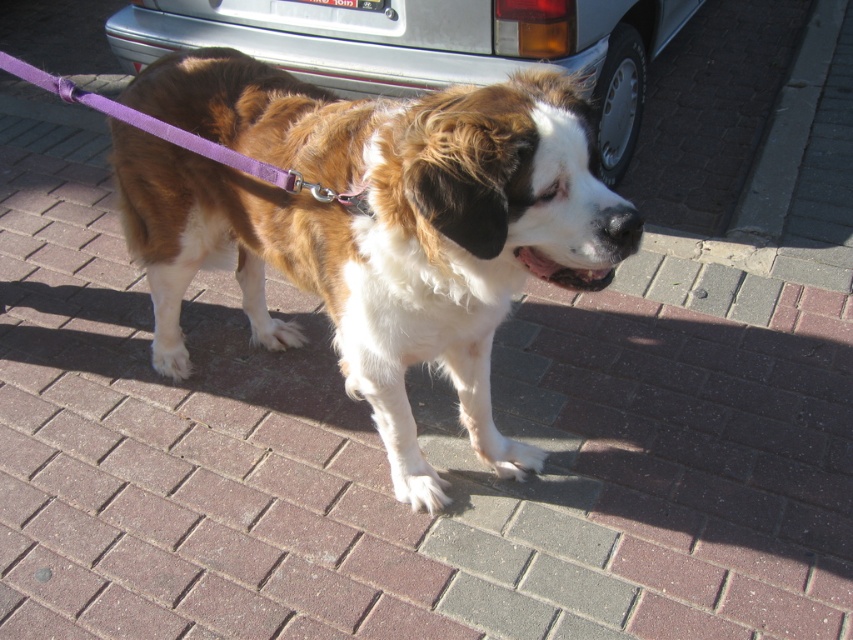
You are a delivery person with a package that needs to be placed between the white glossy car at upper center and the purple fabric leash at center. The package is 1.5 meters long. Will it fit between them?

The distance between the white glossy car at upper center and the purple fabric leash at center is 1.53 meters. Since the package is 1.5 meters long, it will fit between them with a small amount of space remaining.

You are a delivery person trying to reach the purple fabric leash at center to attach a package. However, there is a white glossy car at upper center blocking your path. Can you still reach the leash without moving the car?

The white glossy car at upper center is above the purple fabric leash at center, so the car is not blocking the path to the leash. You can still reach the purple fabric leash at center without moving the car.